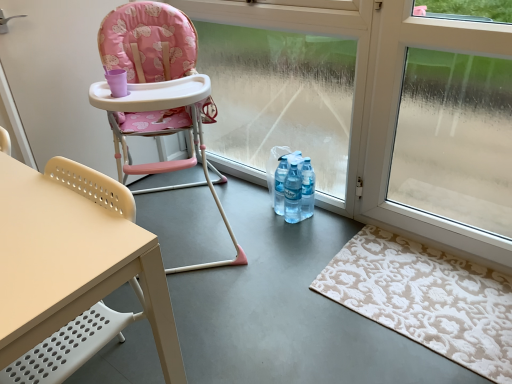
The width and height of the screenshot is (512, 384). What are the coordinates of `vacant region under beige textured rug at lower right (from a real-world perspective)` in the screenshot? It's located at (422, 291).